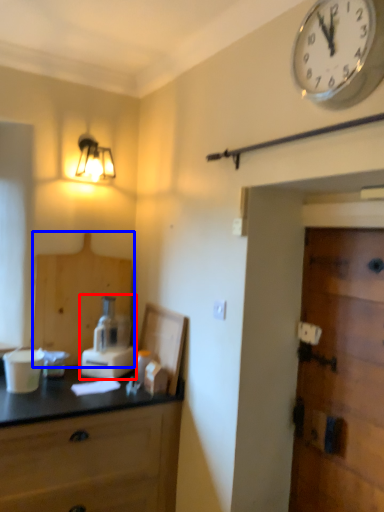
Question: Which point is further to the camera, blender (highlighted by a red box) or cabinetry (highlighted by a blue box)?

Choices:
 (A) blender
 (B) cabinetry

Answer: (B)